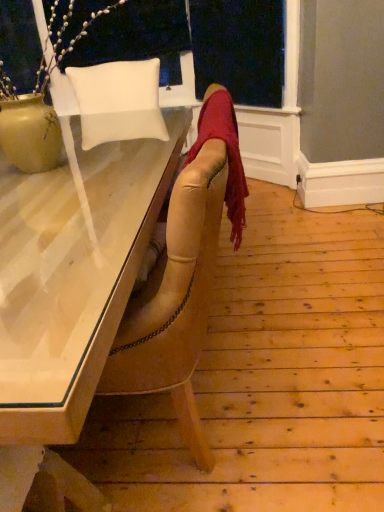
Question: Does point (87, 224) appear closer or farther from the camera than point (198, 152)?

Choices:
 (A) closer
 (B) farther

Answer: (B)

Question: In the image, is matte white desk at center on the left side or the right side of velvet red scarf at center?

Choices:
 (A) right
 (B) left

Answer: (B)

Question: Based on their relative distances, which object is farther from the white leather pillow at upper left?

Choices:
 (A) velvet red scarf at center
 (B) transparent glass window screen at upper center
 (C) matte white desk at center
 (D) matte ceramic vase at upper left

Answer: (A)

Question: Considering the real-world distances, which object is farthest from the matte ceramic vase at upper left?

Choices:
 (A) white leather pillow at upper left
 (B) velvet red scarf at center
 (C) matte white desk at center
 (D) transparent glass window screen at upper center

Answer: (D)